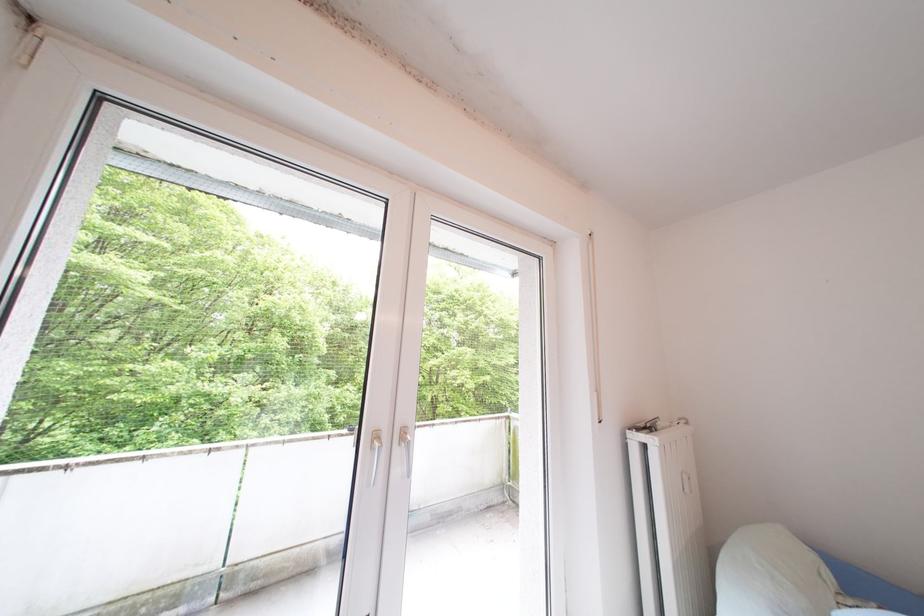
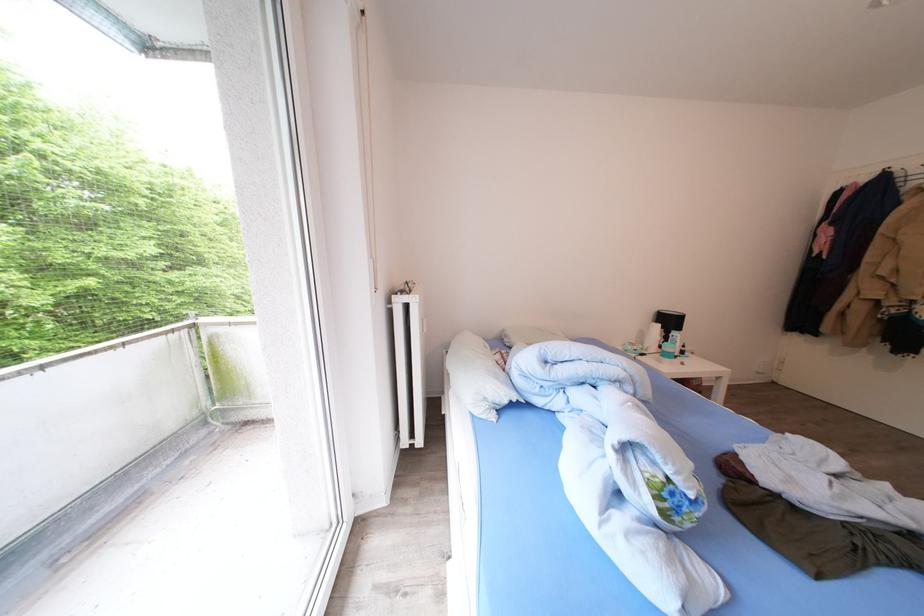
How did the camera likely rotate?

The camera's rotation is toward right-down.